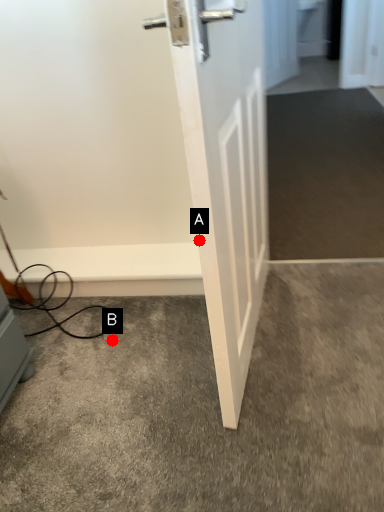
Question: Two points are circled on the image, labeled by A and B beside each circle. Which point is farther to the camera?

Choices:
 (A) A is further
 (B) B is further

Answer: (B)